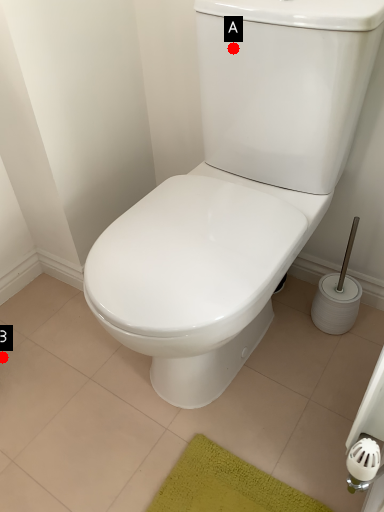
Question: Two points are circled on the image, labeled by A and B beside each circle. Which point is closer to the camera taking this photo?

Choices:
 (A) A is closer
 (B) B is closer

Answer: (A)